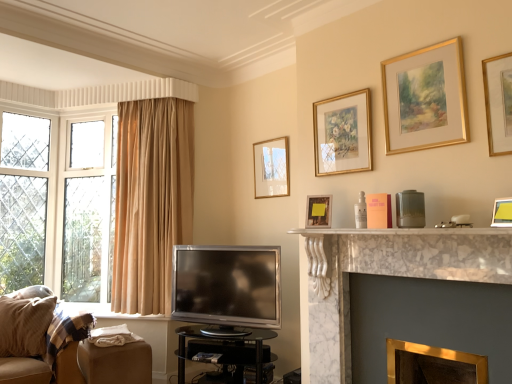
Question: Is transparent glass table at center to the left or to the right of matte gold picture frame at upper center, the second picture frame viewed from the left, in the image?

Choices:
 (A) right
 (B) left

Answer: (B)

Question: Is point (254, 349) closer or farther from the camera than point (330, 198)?

Choices:
 (A) farther
 (B) closer

Answer: (A)

Question: Based on their relative distances, which object is nearer to the matte gold picture frame at upper center, which is the first picture frame from left to right?

Choices:
 (A) gold metallic fireplace at lower right, which appears as the second fireplace when viewed from the top
 (B) gold-framed painting at upper center, marked as the third picture frame in a left-to-right arrangement
 (C) matte yellow picture frame at upper right, which ranks as the fifth picture frame in left-to-right order
 (D) gold-framed painting at upper right, placed as the 3th picture frame when sorted from right to left
 (E) matte gold picture frame at upper center, the second picture frame viewed from the left

Answer: (B)

Question: Estimate the real-world distances between objects in this image. Which object is farther from the gold-framed painting at upper center, which is the 4th picture frame from front to back?

Choices:
 (A) matte gold picture frame at upper center, the 6th picture frame when ordered from right to left
 (B) gold-framed picture at upper right, which ranks as the sixth picture frame in left-to-right order
 (C) brown leather footrest at lower left
 (D) beige fabric couch at lower left
 (E) white marble fireplace at center, the 1th fireplace in the top-to-bottom sequence

Answer: (D)